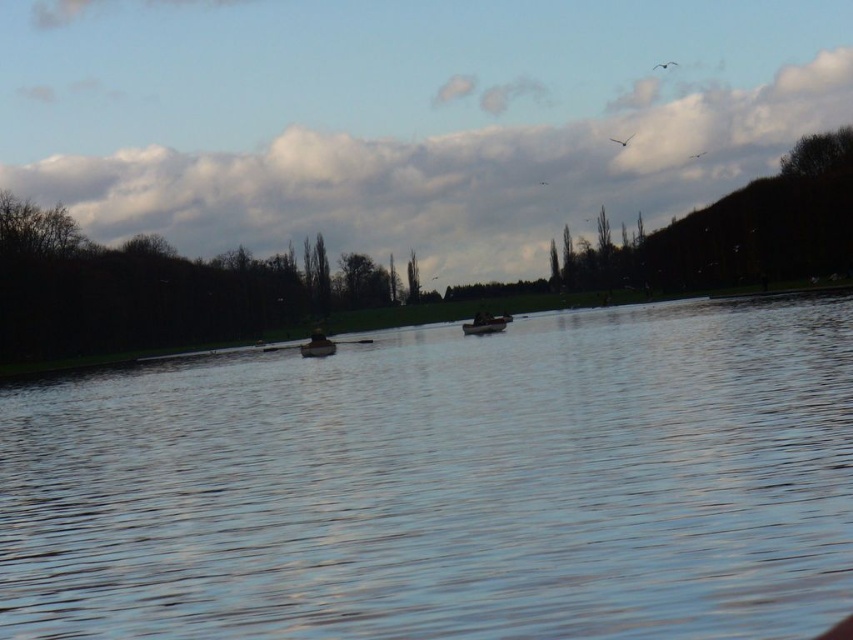
You are standing at the lakeside and want to locate two points marked in the image. Which of the two points, point (468, 328) or point (302, 352), is positioned further away from you?

Point (468, 328) is behind point (302, 352), so it is further away from you.

In the scene shown: You are standing on the lakeside dock and see the smooth water at center and the dark brown wooden boat at center. Which object is positioned to the right side of the other?

The smooth water at center is to the right of the dark brown wooden boat at center.